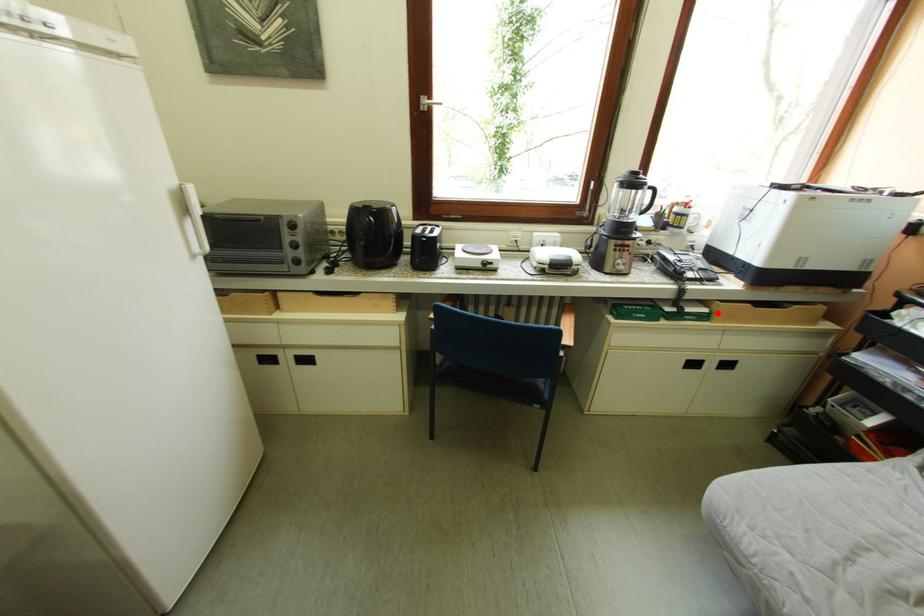
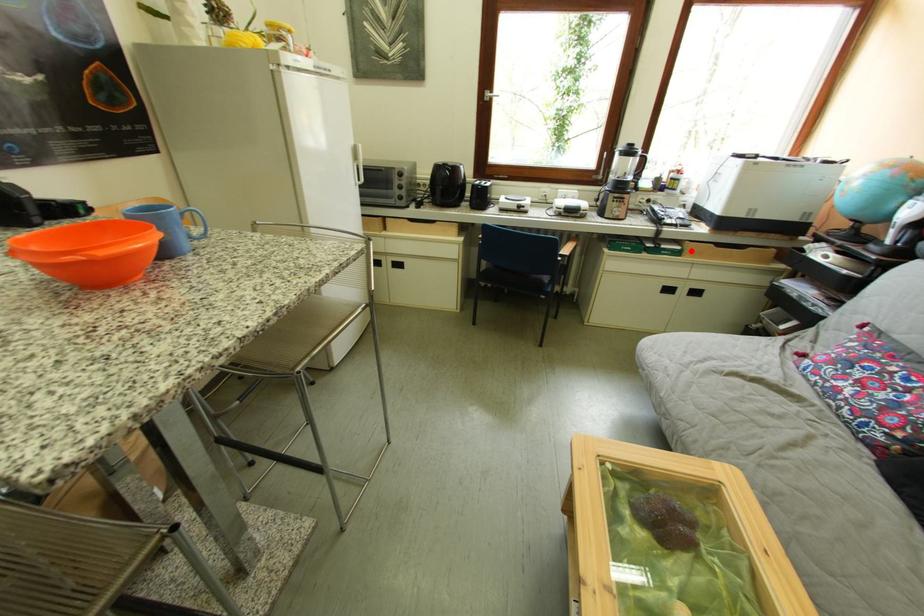
I am providing you with two images of the same scene from different viewpoints. A red point is marked on the first image and another point is marked on the second image. Is the marked point in image1 the same physical position as the marked point in image2?

Yes